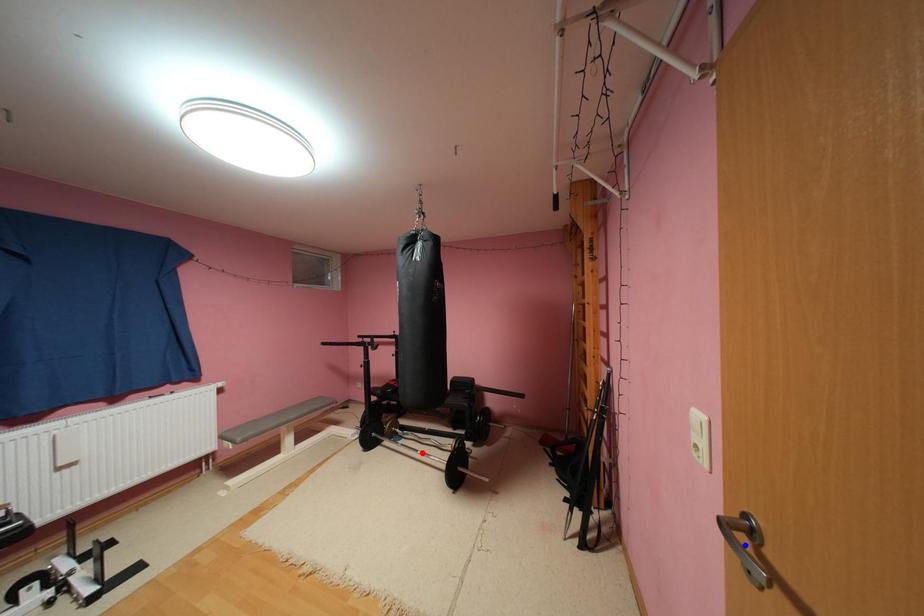
Question: Which of the two points in the image is closer to the camera?

Choices:
 (A) Blue point is closer.
 (B) Red point is closer.

Answer: (A)